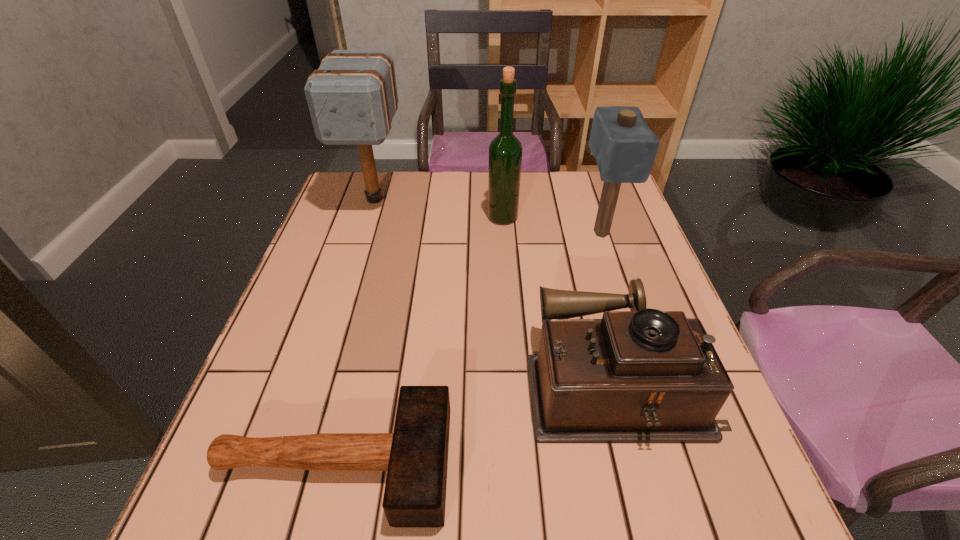
This screenshot has height=540, width=960. What are the coordinates of `free point that satisfies the following two spatial constraints: 1. on the front side of the liquor; 2. on the left side of the rightmost mallet` in the screenshot? It's located at (504, 233).

Locate an element on the screen. The width and height of the screenshot is (960, 540). free location that satisfies the following two spatial constraints: 1. on the front side of the third shortest object; 2. on the hammer head face of the shortest object is located at coordinates (677, 463).